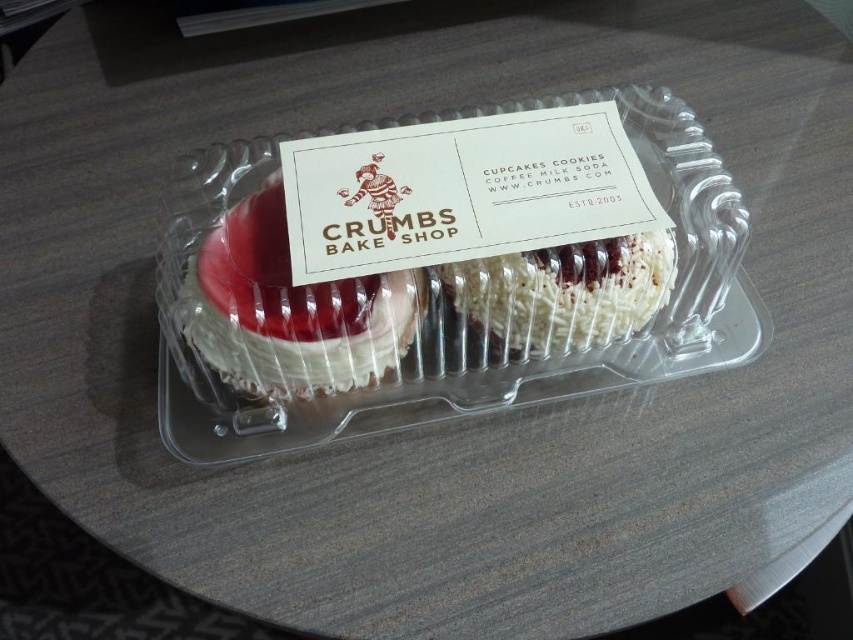
Between point (317, 356) and point (624, 333), which one is positioned in front?

Point (317, 356)

Between matte white cake at center and white coconut-coated pastry at center, which one is positioned lower?

matte white cake at center

Which is behind, point (334, 324) or point (619, 339)?

The point (619, 339) is behind.

The width and height of the screenshot is (853, 640). I want to click on matte white cake at center, so click(288, 310).

Between clear plastic tray at center and matte white cake at center, which one appears on the right side from the viewer's perspective?

Positioned to the right is clear plastic tray at center.

Who is taller, clear plastic tray at center or matte white cake at center?

clear plastic tray at center is taller.

This screenshot has height=640, width=853. What do you see at coordinates (457, 307) in the screenshot?
I see `clear plastic tray at center` at bounding box center [457, 307].

The height and width of the screenshot is (640, 853). I want to click on clear plastic tray at center, so click(457, 307).

Can you confirm if clear plastic tray at center is positioned above white coconut-coated pastry at center?

Indeed, clear plastic tray at center is positioned over white coconut-coated pastry at center.

Is clear plastic tray at center behind white coconut-coated pastry at center?

No, clear plastic tray at center is in front of white coconut-coated pastry at center.

Between point (529, 282) and point (635, 275), which one is positioned behind?

The point (635, 275) is behind.

Find the location of a particular element. The height and width of the screenshot is (640, 853). clear plastic tray at center is located at coordinates (457, 307).